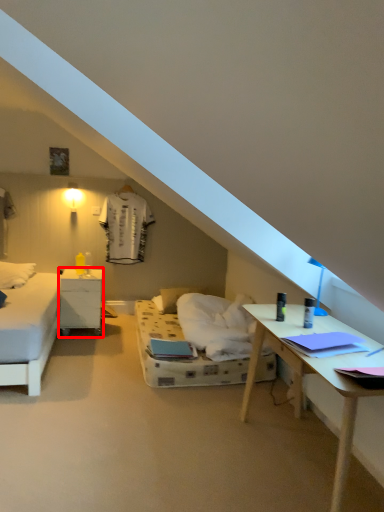
Question: From the image's perspective, where is nightstand (annotated by the red box) located in relation to pillow in the image?

Choices:
 (A) above
 (B) below

Answer: (A)